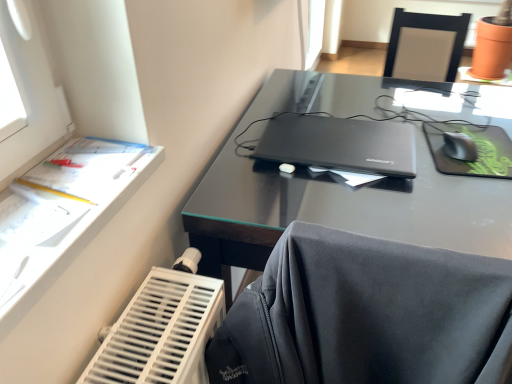
Locate an element on the screen. free point behind black matte mouse pad at right is located at coordinates (454, 108).